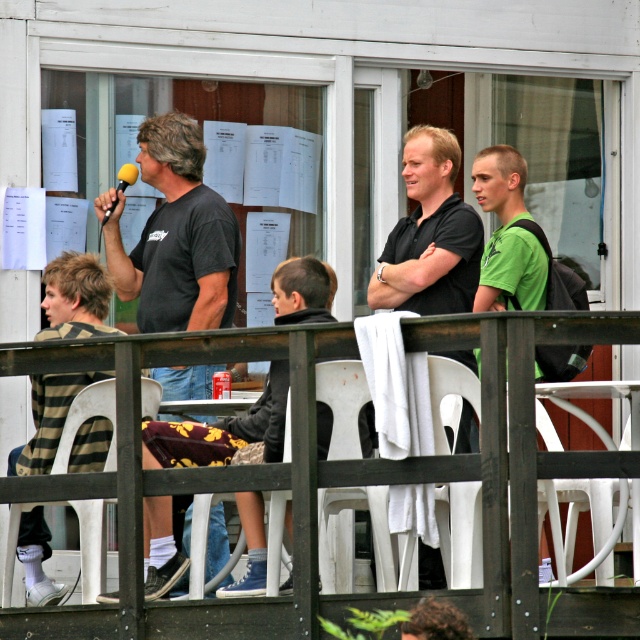
Is black matte t-shirt at left further to the viewer compared to white plastic chair at center?

Yes, it is.

Does black matte t-shirt at left appear on the left side of white plastic chair at center?

Correct, you'll find black matte t-shirt at left to the left of white plastic chair at center.

What do you see at coordinates (176, 236) in the screenshot? The image size is (640, 640). I see `black matte t-shirt at left` at bounding box center [176, 236].

The height and width of the screenshot is (640, 640). Identify the location of black matte t-shirt at left. (176, 236).

Who is positioned more to the left, black matte shirt at center or white plastic chair at center?

white plastic chair at center

Locate an element on the screen. The width and height of the screenshot is (640, 640). black matte shirt at center is located at coordinates (429, 234).

Locate an element on the screen. This screenshot has height=640, width=640. black matte shirt at center is located at coordinates (429, 234).

Is point (256, 506) positioned before point (321, 364)?

No.

Locate an element on the screen. Image resolution: width=640 pixels, height=640 pixels. dark gray sweater at center is located at coordinates (225, 429).